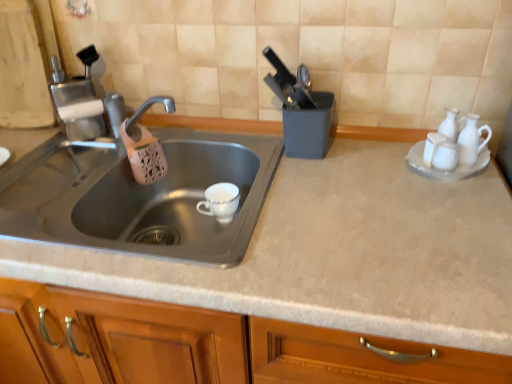
What are the coordinates of `vacant space that is in between matte plastic knife block at upper right and white ceramic saucer at right` in the screenshot? It's located at (367, 158).